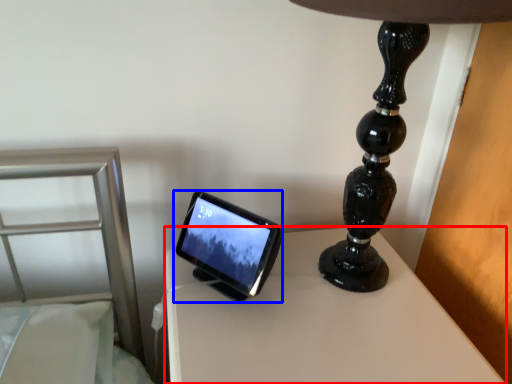
Question: Which point is closer to the camera, table (highlighted by a red box) or tablet computer (highlighted by a blue box)?

Choices:
 (A) table
 (B) tablet computer

Answer: (A)